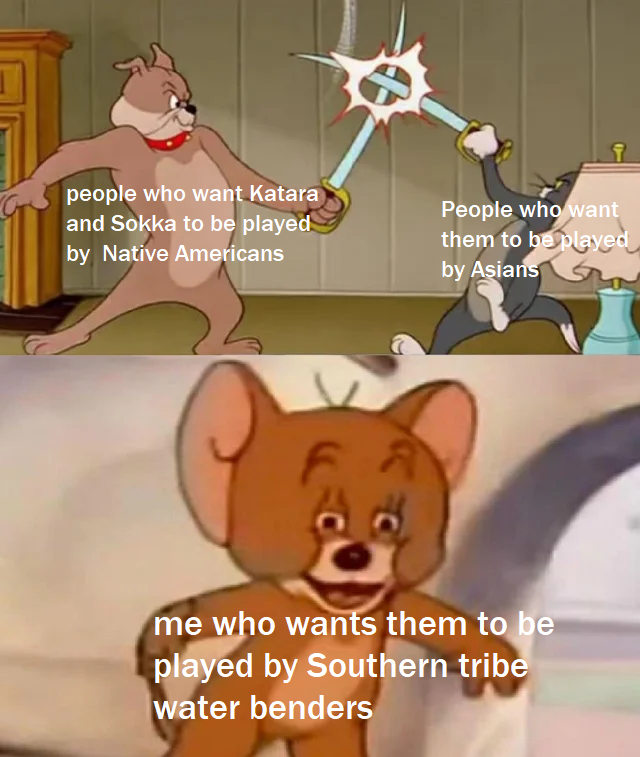
Where is `wall`? Image resolution: width=640 pixels, height=757 pixels. wall is located at coordinates (404, 247).